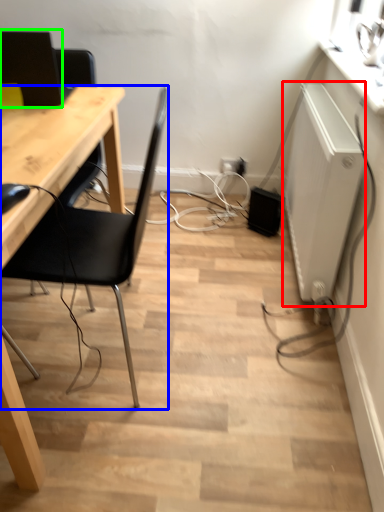
Question: Which object is the closest to the appliance (highlighted by a red box)? Choose among these: chair (highlighted by a blue box) or computer monitor (highlighted by a green box).

Choices:
 (A) chair
 (B) computer monitor

Answer: (A)